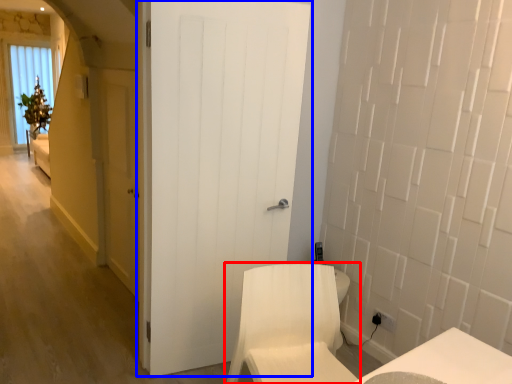
Question: Which of the following is the closest to the observer, furniture (highlighted by a red box) or door (highlighted by a blue box)?

Choices:
 (A) furniture
 (B) door

Answer: (A)